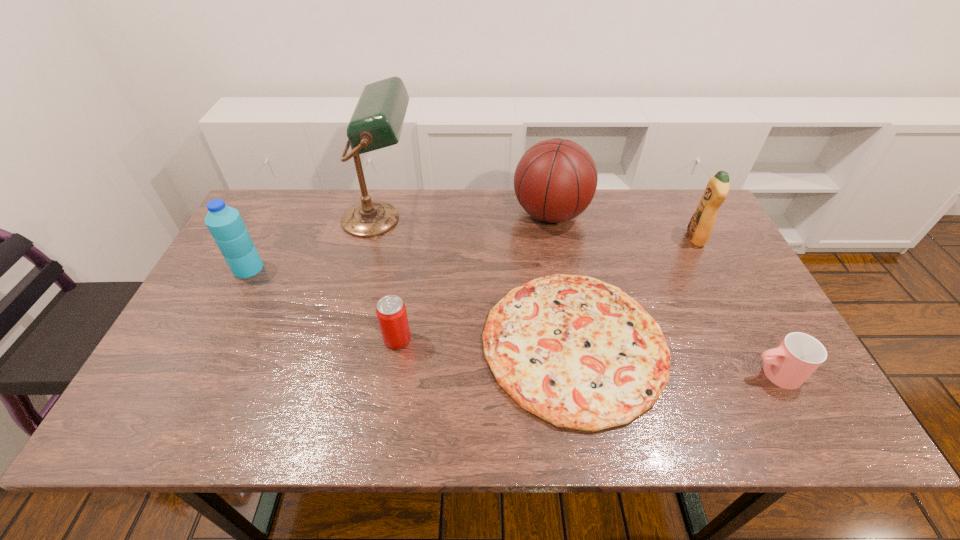
Where is `free space at the far right corner of the desktop`? This screenshot has width=960, height=540. free space at the far right corner of the desktop is located at coordinates click(x=695, y=194).

The height and width of the screenshot is (540, 960). What are the coordinates of `free space between the detergent and the cup` in the screenshot? It's located at (734, 306).

The height and width of the screenshot is (540, 960). I want to click on free spot between the water bottle and the basketball, so click(x=399, y=241).

This screenshot has height=540, width=960. Identify the location of free space between the shortest object and the water bottle. (411, 306).

Image resolution: width=960 pixels, height=540 pixels. In order to click on vacant space that is in between the sixth tallest object and the shortest object in this screenshot , I will do `click(674, 359)`.

Find the location of a particular element. unoccupied position between the basketball and the third shortest object is located at coordinates (474, 276).

Find the location of a particular element. free space between the detergent and the sixth tallest object is located at coordinates (734, 306).

In order to click on vacant point located between the table lamp and the leftmost object in this screenshot , I will do `click(314, 244)`.

The height and width of the screenshot is (540, 960). In order to click on the fourth closest object to the basketball in this screenshot , I will do `click(391, 311)`.

Where is `object that is the third closest one to the fifth tallest object`? object that is the third closest one to the fifth tallest object is located at coordinates (225, 224).